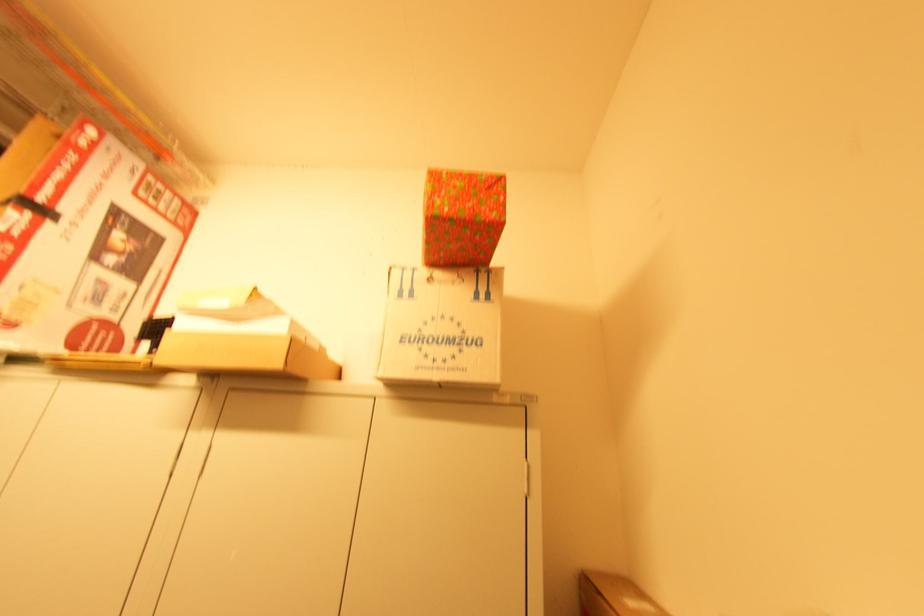
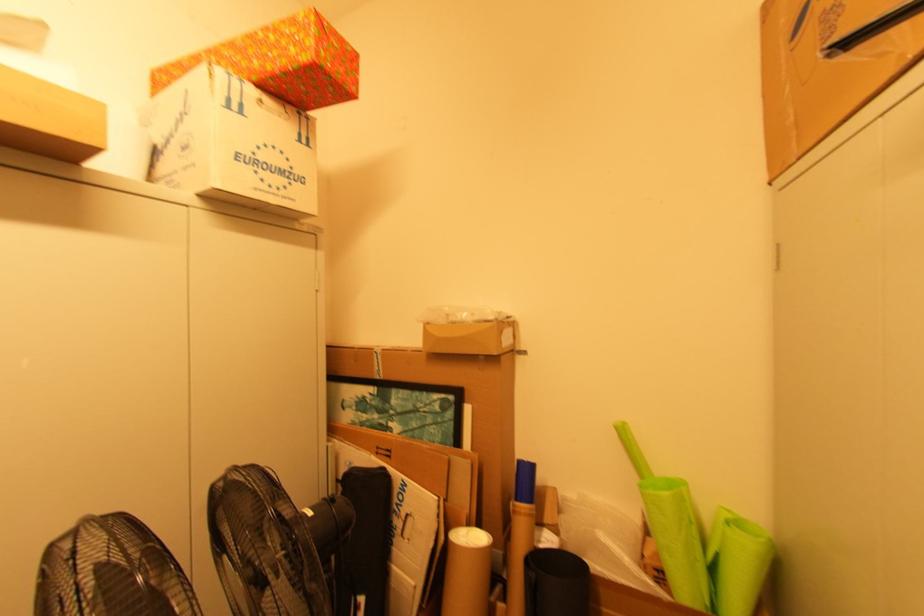
Locate, in the second image, the point that corresponds to point 422,331 in the first image.

(257, 154)